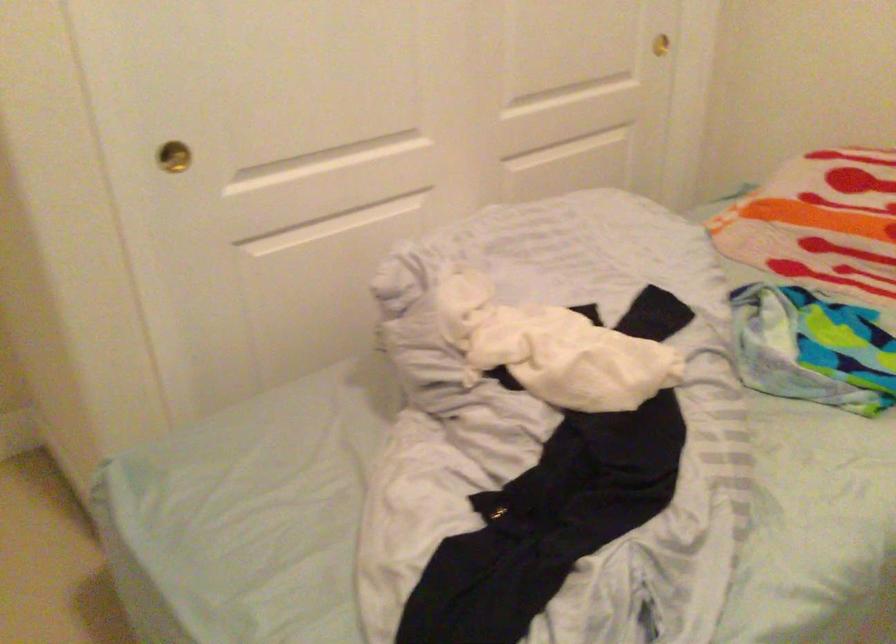
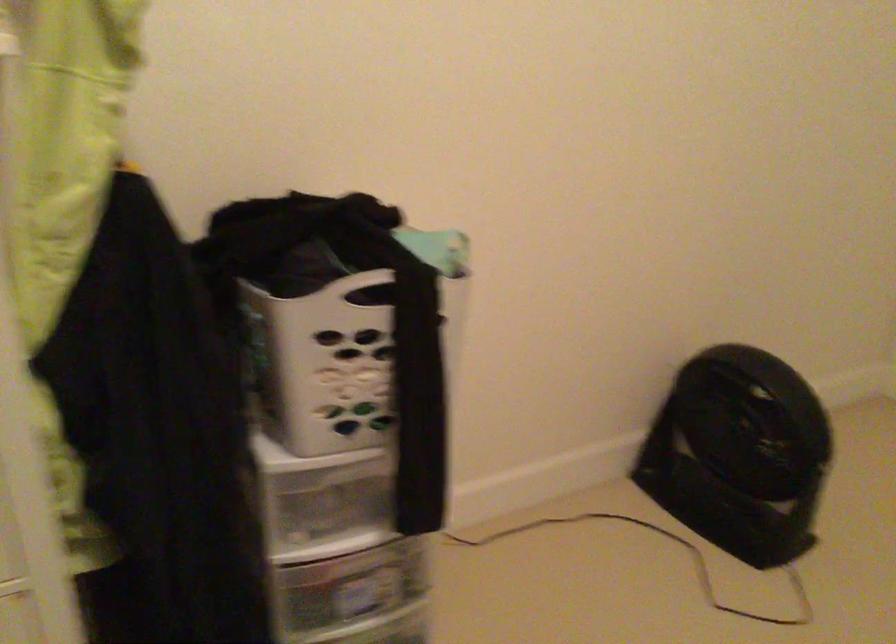
Based on the photo, the images are taken continuously from a first-person perspective. In which direction is your viewpoint rotating?

The rotation direction of the camera is left-down.